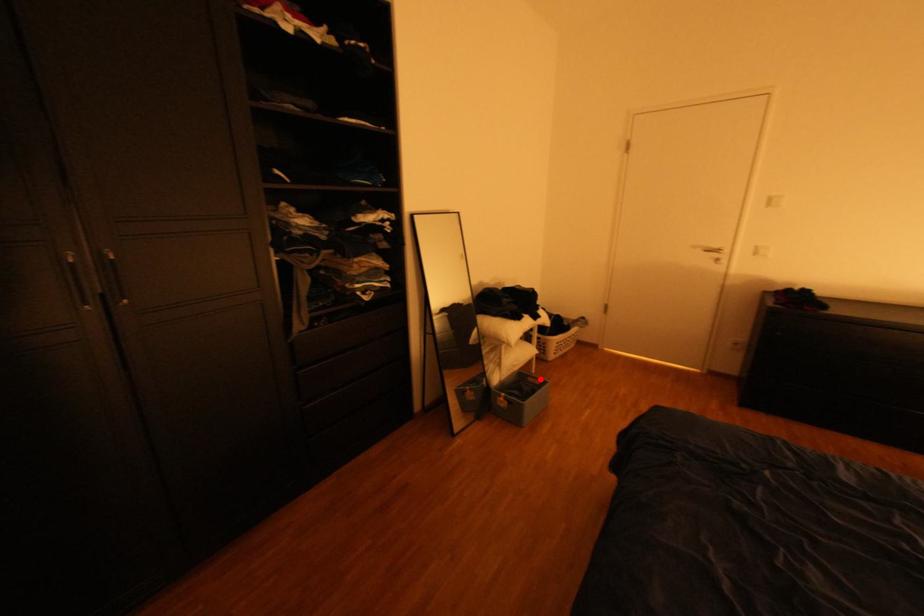
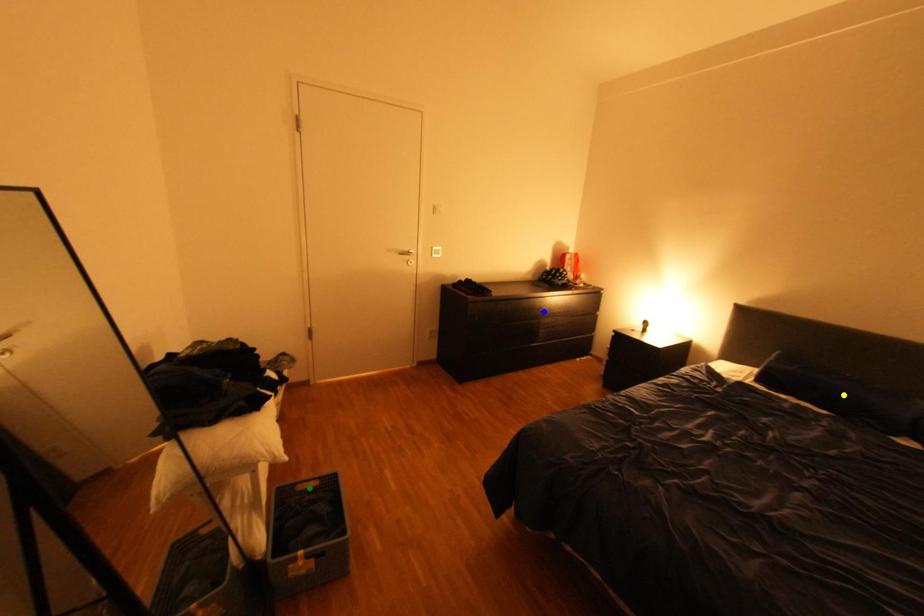
Question: I am providing you with two images of the same scene from different viewpoints. A red point is marked on the first image. You are given multiple points on the second image. Which point in image 2 represents the same 3d spot as the red point in image 1?

Choices:
 (A) blue point
 (B) yellow point
 (C) green point

Answer: (C)